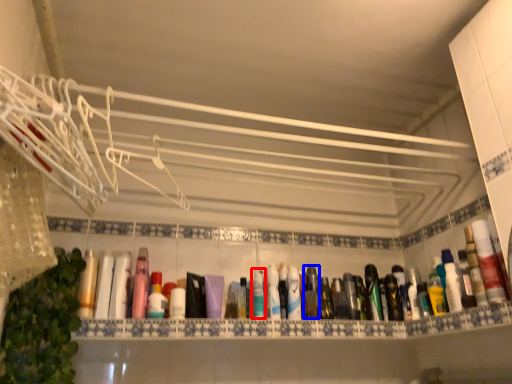
Question: Among these objects, which one is nearest to the camera, mouthwash (highlighted by a red box) or mouthwash (highlighted by a blue box)?

Choices:
 (A) mouthwash
 (B) mouthwash

Answer: (A)